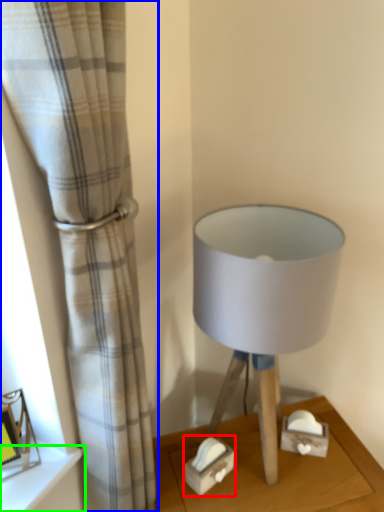
Question: Based on their relative distances, which object is nearer to box (highlighted by a red box)? Choose from curtain (highlighted by a blue box) and shelf (highlighted by a green box).

Choices:
 (A) curtain
 (B) shelf

Answer: (B)